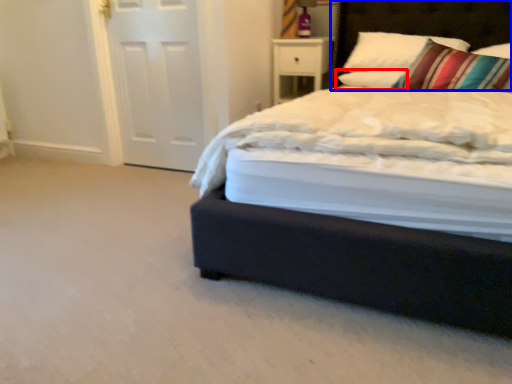
Question: Among these objects, which one is nearest to the camera, pillow (highlighted by a red box) or headboard (highlighted by a blue box)?

Choices:
 (A) pillow
 (B) headboard

Answer: (B)